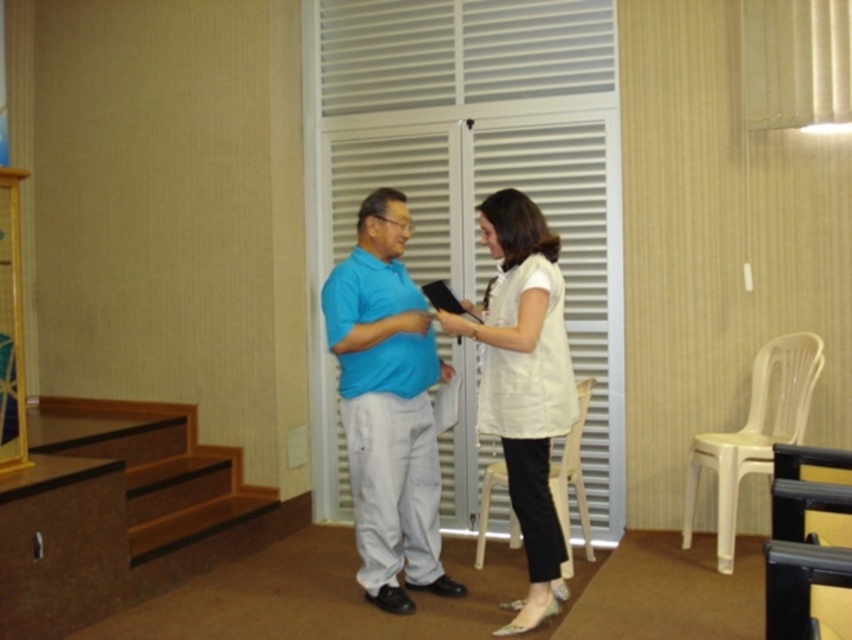
Based on the photo, you are organizing a small event and need to ensure there is enough space between the white fabric dress at center and the white plastic chair at right for attendees to walk comfortably. Based on the scene description, can you determine if the current arrangement allows for a 1 meter wide pathway?

The white fabric dress at center is in front of the white plastic chair at right, but the exact distance between them isn not specified. Without knowing the distance, it is impossible to determine if there is a 1 meter wide pathway available.

You are organizing a small event and need to decide where to place a new table. The table is the same size as the white plastic chair at right. Based on the image, can the table fit in the space currently occupied by the white fabric dress at center?

The white fabric dress at center is bigger than the white plastic chair at right. Since the table is the same size as the white plastic chair at right, it would likely fit in the space currently occupied by the white fabric dress at center because the dress requires more space, leaving room for the table.